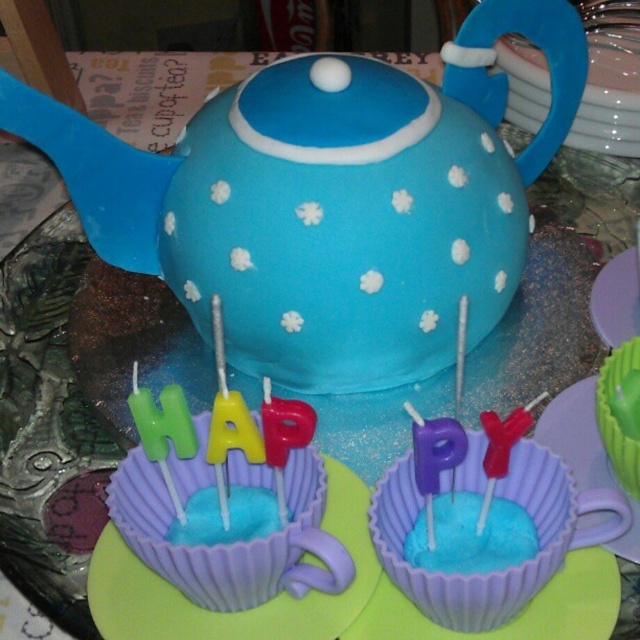
Question: Considering the relative positions of matte purple cupcake liner at center and blue sugar frosting at lower center in the image provided, where is matte purple cupcake liner at center located with respect to blue sugar frosting at lower center?

Choices:
 (A) above
 (B) below

Answer: (B)

Question: Which object is farther from the camera taking this photo?

Choices:
 (A) green paper cupcake at lower right
 (B) blue matte frosting at lower center
 (C) matte purple saucer at center
 (D) matte purple cupcake liner at center

Answer: (B)

Question: Can you confirm if blue fondant cupcake at center is positioned to the left of blue sugar frosting at lower center?

Choices:
 (A) no
 (B) yes

Answer: (A)

Question: Does matte purple cupcake liner at center lie behind blue matte frosting at lower center?

Choices:
 (A) no
 (B) yes

Answer: (A)

Question: Which of the following is the closest to the observer?

Choices:
 (A) green paper cupcake at lower right
 (B) matte purple cupcake liner at center
 (C) blue sugar frosting at lower center

Answer: (C)

Question: Which object appears farthest from the camera in this image?

Choices:
 (A) matte purple cupcake liner at center
 (B) blue fondant cupcake at center
 (C) matte purple saucer at center
 (D) green paper cupcake at lower right

Answer: (D)